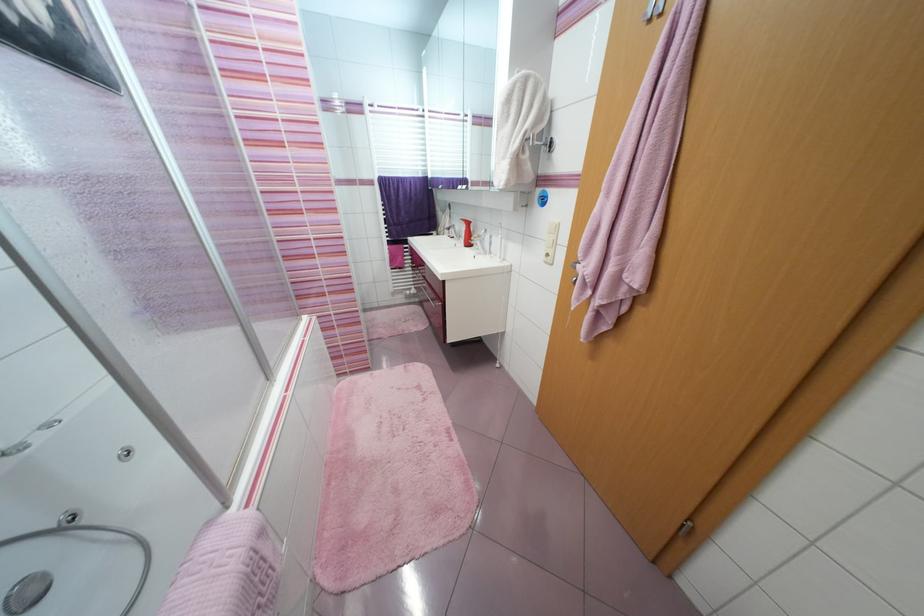
The height and width of the screenshot is (616, 924). Find the location of `white light switch`. white light switch is located at coordinates (551, 241).